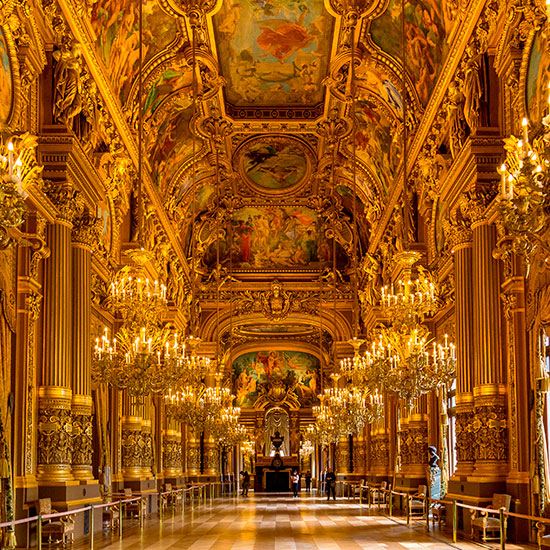
I want to click on curtains, so click(276, 423).